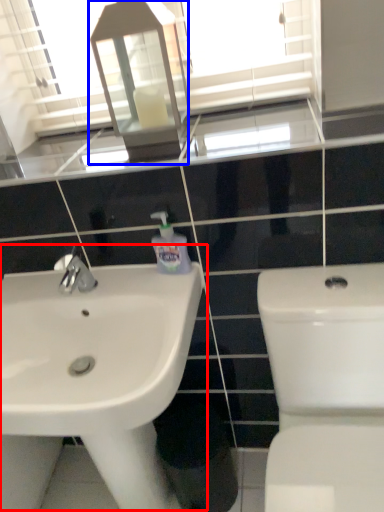
Question: Among these objects, which one is nearest to the camera, sink (highlighted by a red box) or medicine cabinet (highlighted by a blue box)?

Choices:
 (A) sink
 (B) medicine cabinet

Answer: (A)